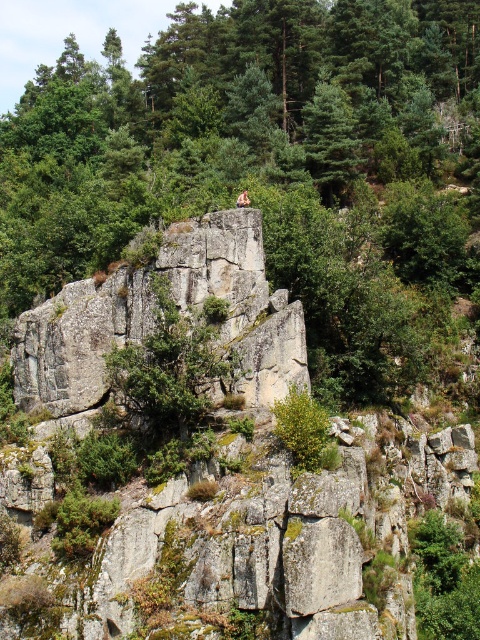
You are a photographer standing at the base of the rocky outcrop. You want to capture a photo of the green leafy tree at upper center. Can you estimate how far you need to walk forward to get the tree into your camera frame?

The green leafy tree at upper center is 154.45 feet from camera. To get it into your camera frame, you would need to walk forward approximately 154.45 feet.